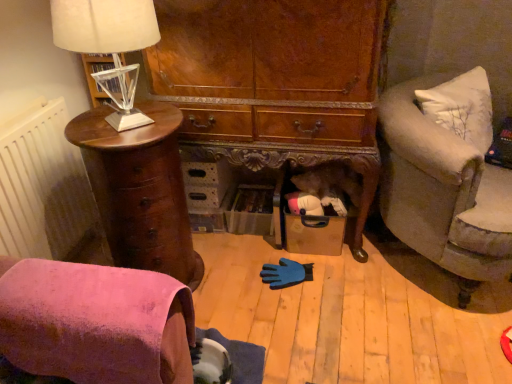
Question: Is mahogany wood chest of drawers at left to the right of velvet gray couch at right from the viewer's perspective?

Choices:
 (A) no
 (B) yes

Answer: (A)

Question: Is there a large distance between mahogany wood chest of drawers at left and velvet gray couch at right?

Choices:
 (A) yes
 (B) no

Answer: (B)

Question: Considering the relative positions of mahogany wood chest of drawers at left and velvet gray couch at right in the image provided, is mahogany wood chest of drawers at left behind velvet gray couch at right?

Choices:
 (A) no
 (B) yes

Answer: (B)

Question: Is mahogany wood chest of drawers at left thinner than velvet gray couch at right?

Choices:
 (A) no
 (B) yes

Answer: (B)

Question: Does mahogany wood chest of drawers at left have a larger size compared to velvet gray couch at right?

Choices:
 (A) yes
 (B) no

Answer: (B)

Question: Considering the positions of pink suede chair at lower left and white fabric lampshade at left in the image, is pink suede chair at lower left wider or thinner than white fabric lampshade at left?

Choices:
 (A) thin
 (B) wide

Answer: (B)

Question: Considering their positions, is pink suede chair at lower left located in front of or behind white fabric lampshade at left?

Choices:
 (A) front
 (B) behind

Answer: (A)

Question: Looking at the image, does pink suede chair at lower left seem bigger or smaller compared to white fabric lampshade at left?

Choices:
 (A) big
 (B) small

Answer: (B)

Question: From the image's perspective, is pink suede chair at lower left positioned above or below white fabric lampshade at left?

Choices:
 (A) above
 (B) below

Answer: (B)

Question: Do you think mahogany wood chest of drawers at left is within white textured radiator at left, or outside of it?

Choices:
 (A) inside
 (B) outside

Answer: (B)

Question: Considering the positions of mahogany wood chest of drawers at left and white textured radiator at left in the image, is mahogany wood chest of drawers at left taller or shorter than white textured radiator at left?

Choices:
 (A) tall
 (B) short

Answer: (B)

Question: Is point (130, 170) positioned closer to the camera than point (41, 218)?

Choices:
 (A) farther
 (B) closer

Answer: (B)

Question: Is mahogany wood chest of drawers at left wider or thinner than white textured radiator at left?

Choices:
 (A) wide
 (B) thin

Answer: (A)

Question: From their relative heights in the image, would you say white fabric lampshade at left is taller or shorter than mahogany wood chest of drawers at left?

Choices:
 (A) tall
 (B) short

Answer: (B)

Question: Looking at the image, does white fabric lampshade at left seem bigger or smaller compared to mahogany wood chest of drawers at left?

Choices:
 (A) big
 (B) small

Answer: (B)